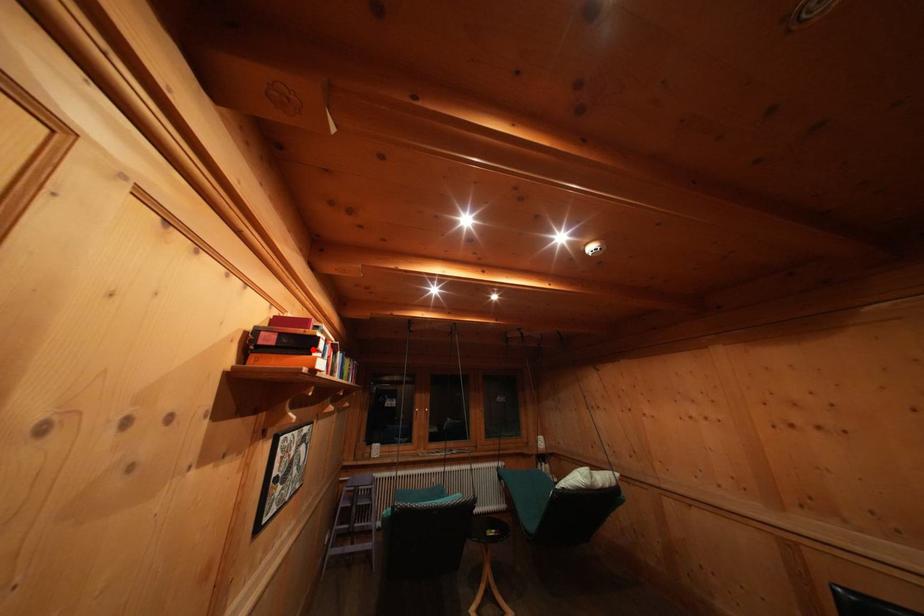
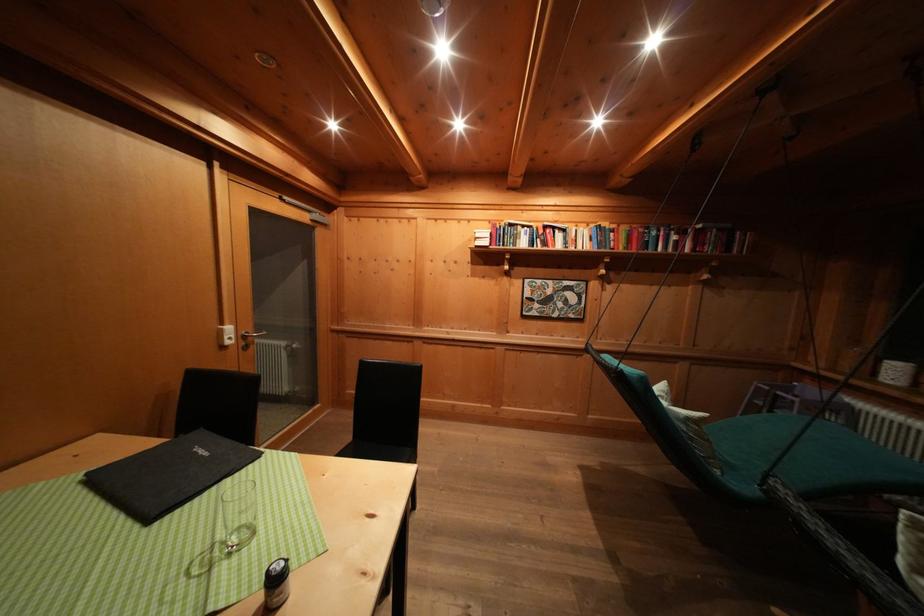
Question: I am providing you with two images of the same scene from different viewpoints. A red point is marked on the first image. Can you still see the location of the red point in image 2?

Choices:
 (A) Yes
 (B) No

Answer: (B)